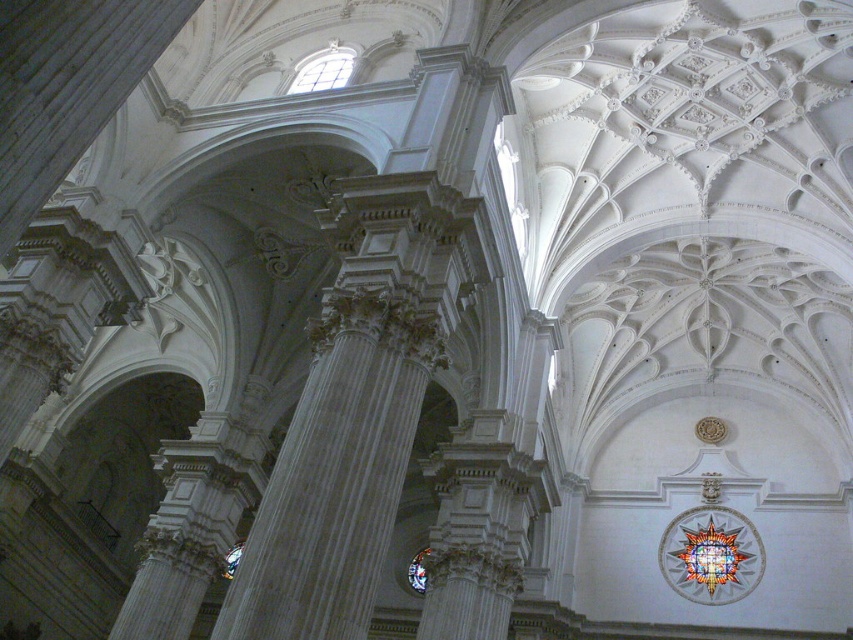
Question: In this image, where is clear glass window at upper center located relative to stained glass window at center?

Choices:
 (A) left
 (B) right

Answer: (A)

Question: Can you confirm if clear glass window at upper center is positioned to the left of stained glass window at center?

Choices:
 (A) yes
 (B) no

Answer: (A)

Question: Among these objects, which one is nearest to the camera?

Choices:
 (A) stained glass window at center
 (B) clear glass window at upper center

Answer: (B)

Question: Is clear glass window at upper center wider than stained glass window at center?

Choices:
 (A) no
 (B) yes

Answer: (B)

Question: Among these objects, which one is farthest from the camera?

Choices:
 (A) clear glass window at upper center
 (B) stained glass window at center

Answer: (B)